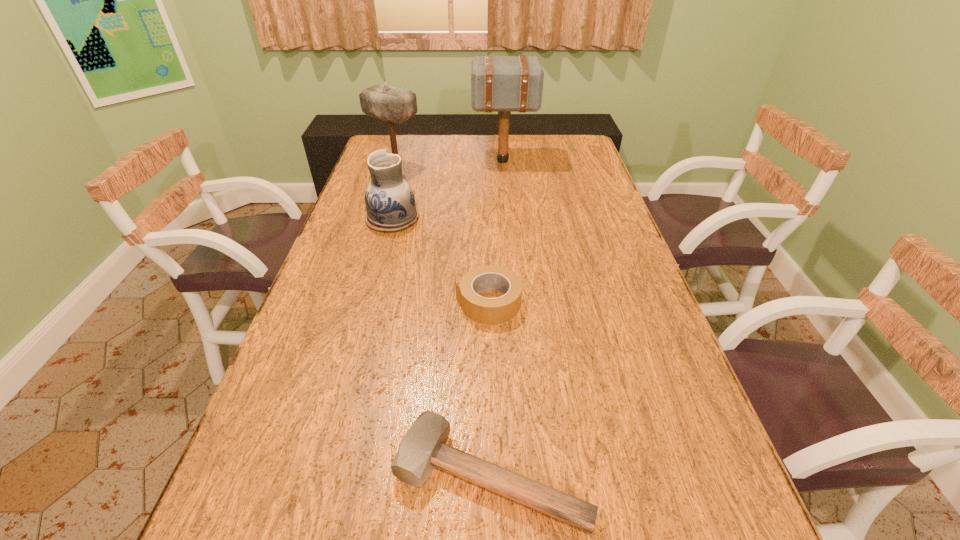
This screenshot has height=540, width=960. Find the location of `blank space located at the edge of the duct tape`. blank space located at the edge of the duct tape is located at coordinates (412, 302).

Where is `free space located on the right of the nearest mallet`? Image resolution: width=960 pixels, height=540 pixels. free space located on the right of the nearest mallet is located at coordinates (718, 476).

I want to click on mallet that is positioned at the left edge, so click(x=395, y=105).

Where is `pottery that is at the left edge`? pottery that is at the left edge is located at coordinates (390, 203).

Where is `object that is at the far left corner`? This screenshot has height=540, width=960. object that is at the far left corner is located at coordinates (395, 105).

Where is `vacant area at the left edge of the desktop`? vacant area at the left edge of the desktop is located at coordinates (227, 505).

This screenshot has width=960, height=540. I want to click on free region at the right edge of the desktop, so click(x=684, y=411).

Locate an element on the screen. The width and height of the screenshot is (960, 540). vacant space at the far left corner is located at coordinates (407, 153).

I want to click on blank region between the nearest object and the leftmost mallet, so 444,322.

Where is `free space that is in between the leftmost mallet and the nearest object`? The height and width of the screenshot is (540, 960). free space that is in between the leftmost mallet and the nearest object is located at coordinates (444, 322).